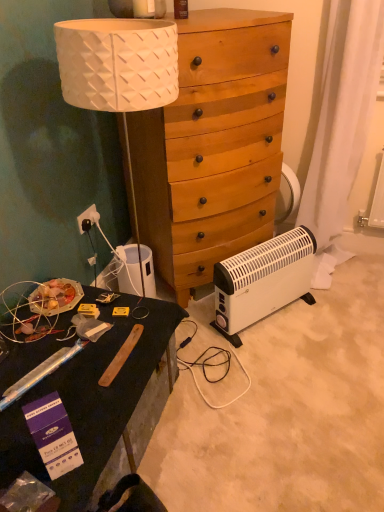
Question: Would you say white plastic power outlet at lower left contains wooden dresser at center?

Choices:
 (A) yes
 (B) no

Answer: (B)

Question: From the image's perspective, is white plastic power outlet at lower left located above wooden dresser at center?

Choices:
 (A) no
 (B) yes

Answer: (A)

Question: Considering the relative sizes of white plastic power outlet at lower left and wooden dresser at center in the image provided, is white plastic power outlet at lower left smaller than wooden dresser at center?

Choices:
 (A) no
 (B) yes

Answer: (B)

Question: From the image's perspective, would you say white plastic power outlet at lower left is shown under wooden dresser at center?

Choices:
 (A) no
 (B) yes

Answer: (B)

Question: Is white plastic power outlet at lower left facing away from wooden dresser at center?

Choices:
 (A) yes
 (B) no

Answer: (B)

Question: Based on their sizes in the image, would you say white plastic power outlet at lower left is bigger or smaller than purple cardboard box at lower left?

Choices:
 (A) big
 (B) small

Answer: (B)

Question: In terms of width, does white plastic power outlet at lower left look wider or thinner when compared to purple cardboard box at lower left?

Choices:
 (A) thin
 (B) wide

Answer: (A)

Question: Is white plastic power outlet at lower left spatially inside purple cardboard box at lower left, or outside of it?

Choices:
 (A) inside
 (B) outside

Answer: (B)

Question: From a real-world perspective, is white plastic power outlet at lower left positioned above or below purple cardboard box at lower left?

Choices:
 (A) below
 (B) above

Answer: (A)

Question: From the image's perspective, is translucent plastic bottle at upper center above or below white plastic power outlet at lower left?

Choices:
 (A) below
 (B) above

Answer: (B)

Question: Is point (175, 3) positioned closer to the camera than point (89, 205)?

Choices:
 (A) farther
 (B) closer

Answer: (B)

Question: Considering their positions, is translucent plastic bottle at upper center located in front of or behind white plastic power outlet at lower left?

Choices:
 (A) behind
 (B) front

Answer: (B)

Question: Is translucent plastic bottle at upper center inside the boundaries of white plastic power outlet at lower left, or outside?

Choices:
 (A) outside
 (B) inside

Answer: (A)

Question: From the image's perspective, is white plastic power outlet at lower left located above or below white plastic radiator at lower right?

Choices:
 (A) below
 (B) above

Answer: (B)

Question: From a real-world perspective, relative to white plastic radiator at lower right, is white plastic power outlet at lower left vertically above or below?

Choices:
 (A) below
 (B) above

Answer: (B)